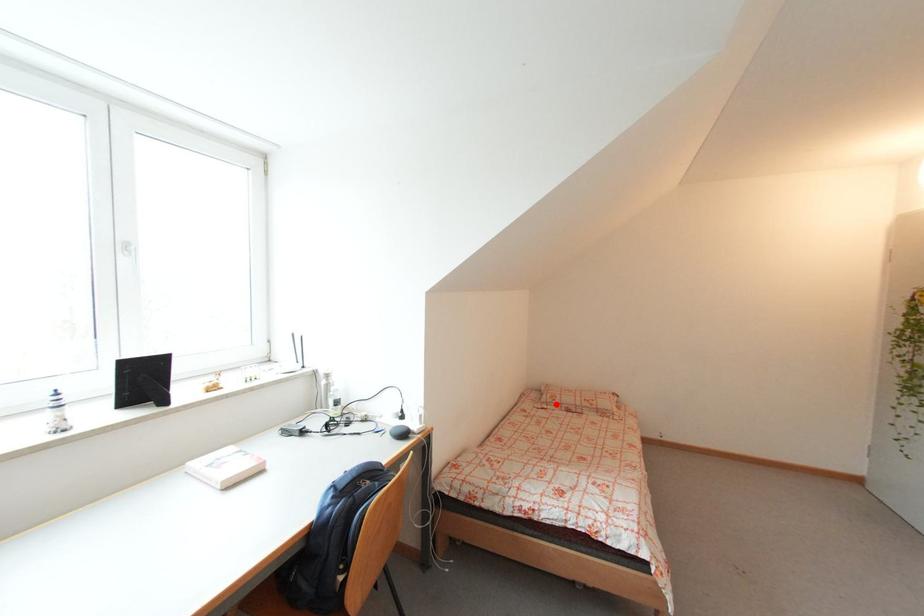
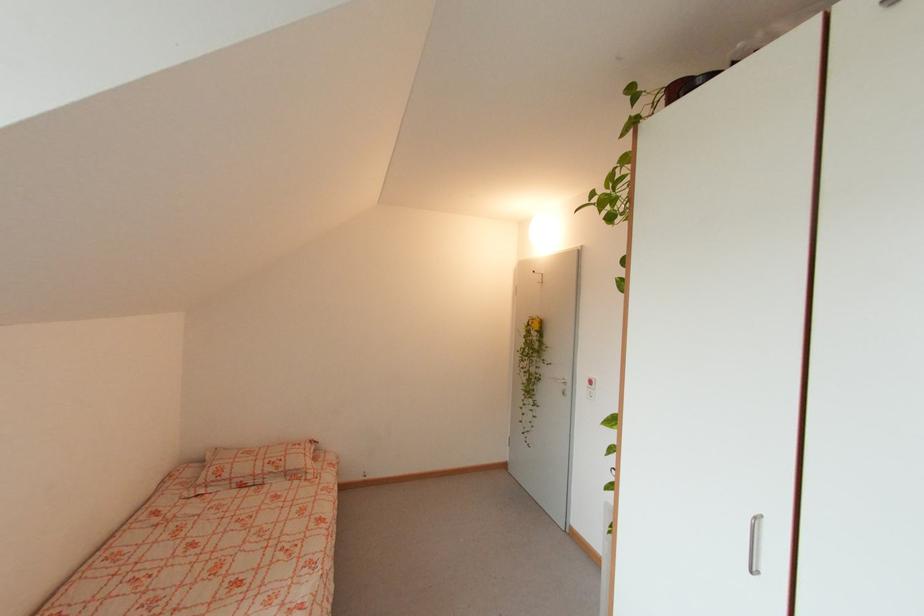
Where in the second image is the point corresponding to the highlighted location from the first image?

(219, 484)